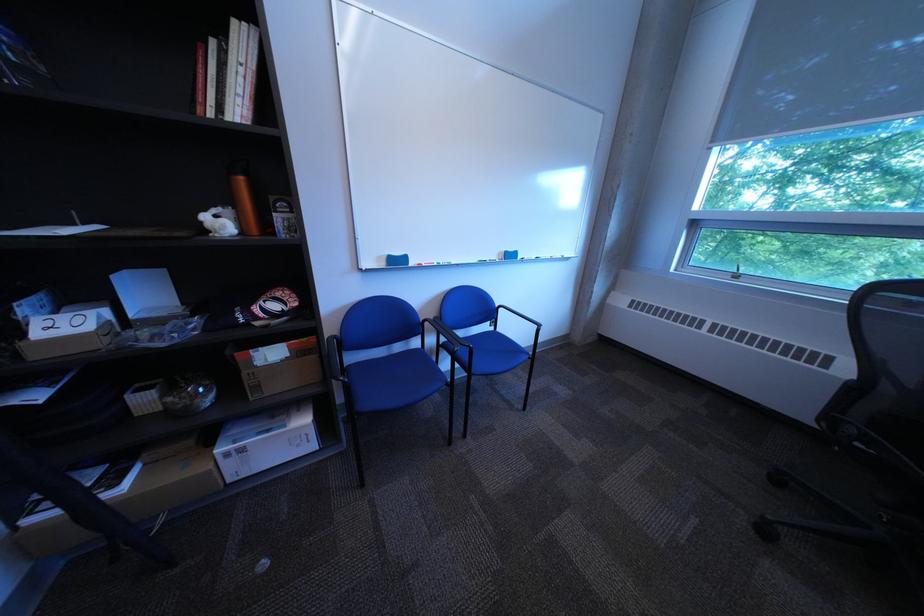
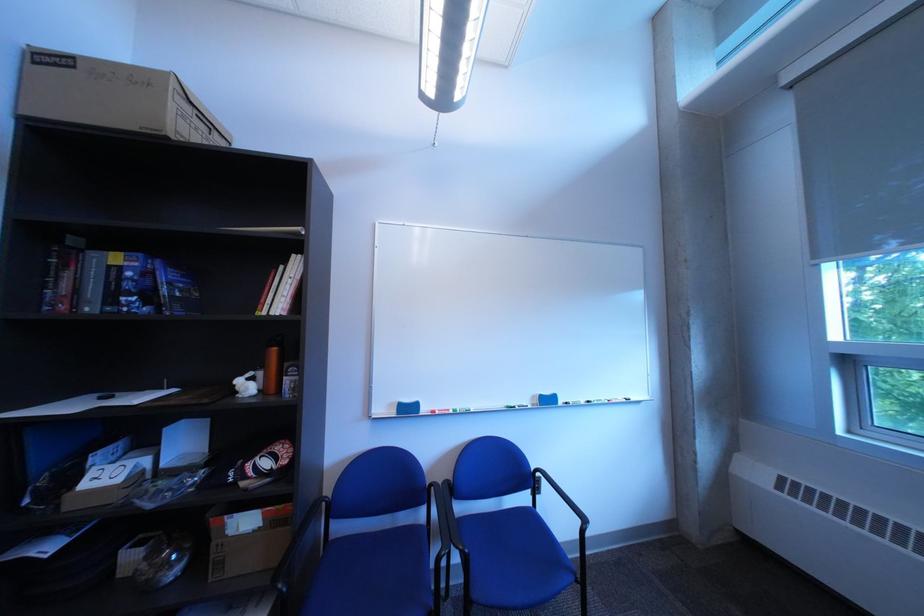
Find the pixel in the second image that matches pixel 394 260 in the first image.

(406, 407)